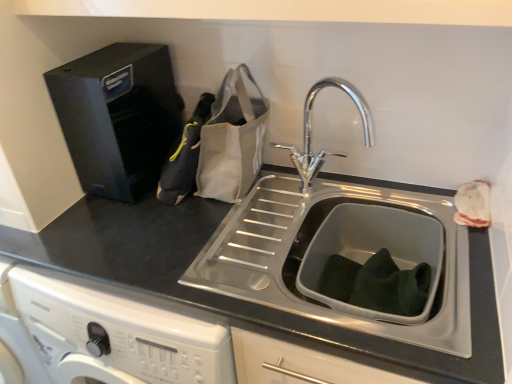
Question: Is canvas tote bag at center a part of black fabric bag at left?

Choices:
 (A) no
 (B) yes

Answer: (A)

Question: From the image's perspective, would you say black fabric bag at left is shown under canvas tote bag at center?

Choices:
 (A) yes
 (B) no

Answer: (A)

Question: Considering the relative sizes of black fabric bag at left and canvas tote bag at center in the image provided, is black fabric bag at left taller than canvas tote bag at center?

Choices:
 (A) no
 (B) yes

Answer: (A)

Question: From a real-world perspective, is black fabric bag at left located beneath canvas tote bag at center?

Choices:
 (A) yes
 (B) no

Answer: (A)

Question: From a real-world perspective, does black fabric bag at left stand above canvas tote bag at center?

Choices:
 (A) yes
 (B) no

Answer: (B)

Question: Considering the relative sizes of black fabric bag at left and canvas tote bag at center in the image provided, is black fabric bag at left shorter than canvas tote bag at center?

Choices:
 (A) no
 (B) yes

Answer: (B)

Question: From a real-world perspective, is black fabric bag at left on black plastic water dispenser at upper left?

Choices:
 (A) no
 (B) yes

Answer: (A)

Question: Does black fabric bag at left lie behind black plastic water dispenser at upper left?

Choices:
 (A) yes
 (B) no

Answer: (A)

Question: Considering the relative positions of black fabric bag at left and black plastic water dispenser at upper left in the image provided, is black fabric bag at left to the right of black plastic water dispenser at upper left from the viewer's perspective?

Choices:
 (A) yes
 (B) no

Answer: (A)

Question: Can you confirm if black fabric bag at left is taller than black plastic water dispenser at upper left?

Choices:
 (A) yes
 (B) no

Answer: (B)

Question: Is black fabric bag at left bigger than black plastic water dispenser at upper left?

Choices:
 (A) no
 (B) yes

Answer: (A)

Question: From the image's perspective, would you say black fabric bag at left is positioned over black plastic water dispenser at upper left?

Choices:
 (A) no
 (B) yes

Answer: (A)

Question: Is black plastic water dispenser at upper left to the right of chrome metallic faucet at center from the viewer's perspective?

Choices:
 (A) no
 (B) yes

Answer: (A)